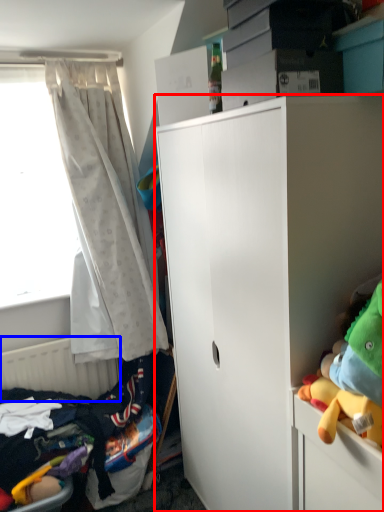
Question: Among these objects, which one is farthest to the camera, cabinetry (highlighted by a red box) or radiator (highlighted by a blue box)?

Choices:
 (A) cabinetry
 (B) radiator

Answer: (B)